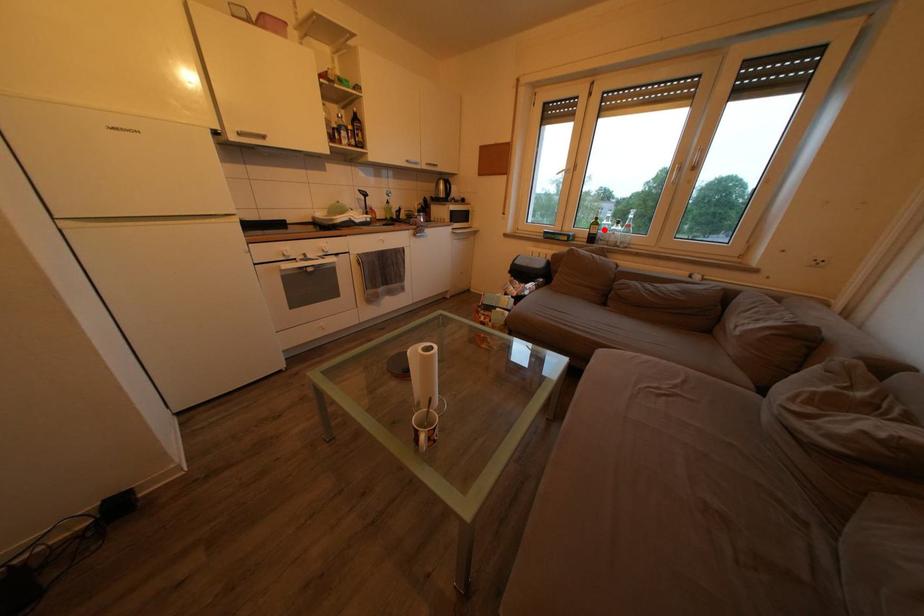
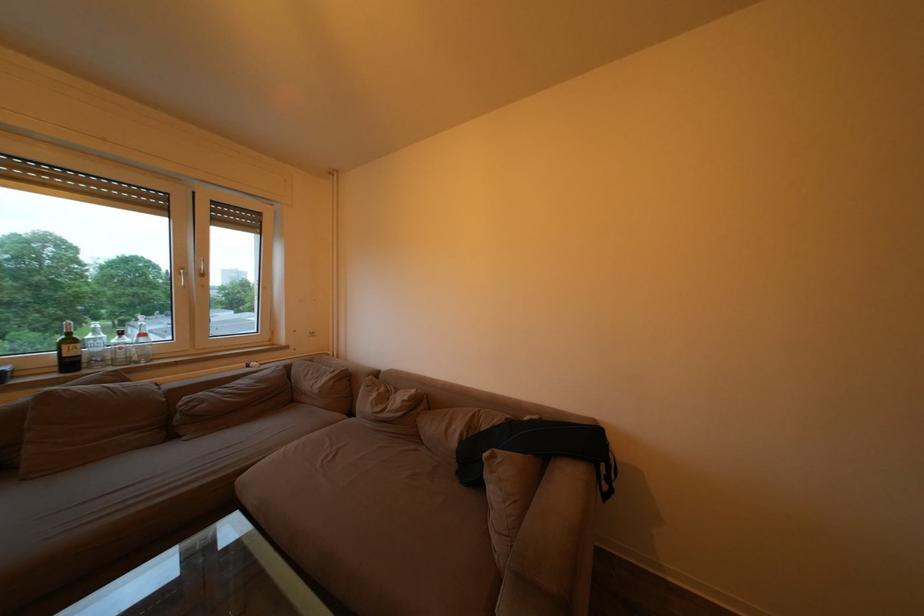
Question: I am providing you with two images of the same scene from different viewpoints. Given a red point in image1, look at the same physical point in image2. Is it:

Choices:
 (A) Closer to the viewpoint
 (B) Farther from the viewpoint

Answer: (B)